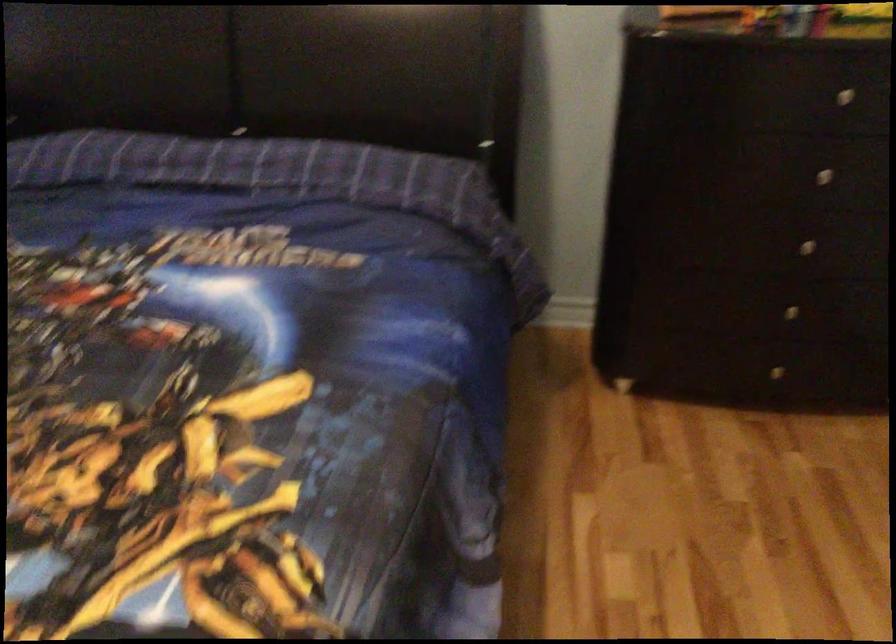
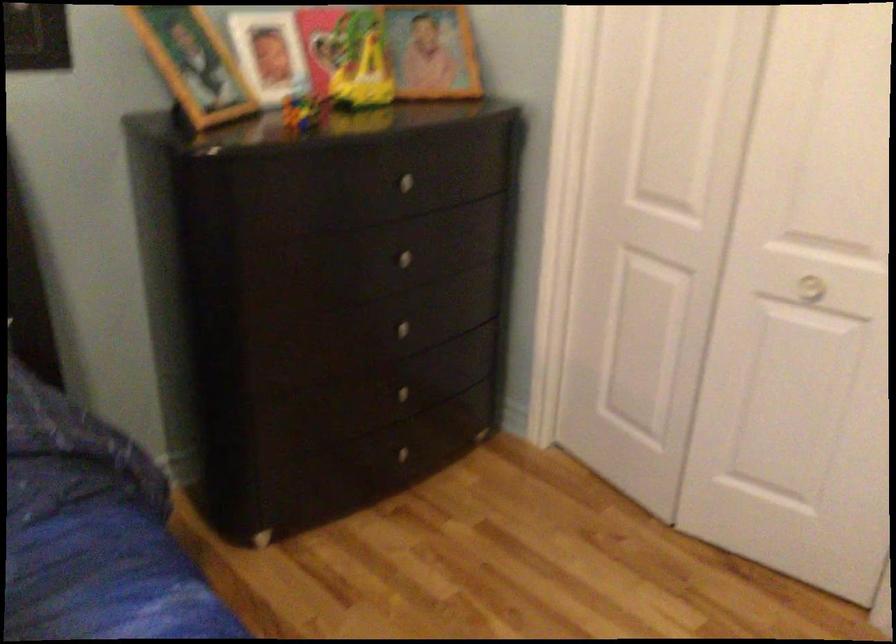
The point at (805, 252) is marked in the first image. Where is the corresponding point in the second image?

(409, 332)